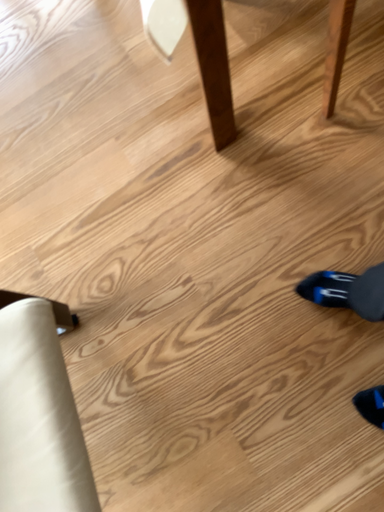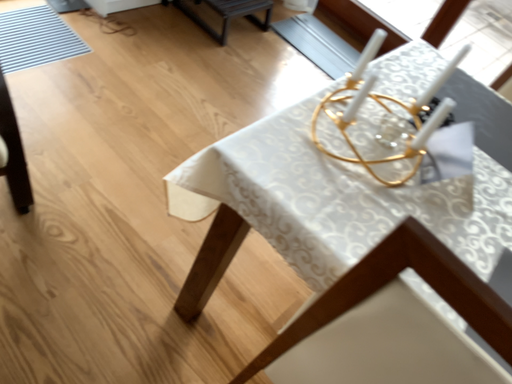
Question: Which way did the camera rotate in the video?

Choices:
 (A) rotated downward
 (B) rotated upward

Answer: (B)